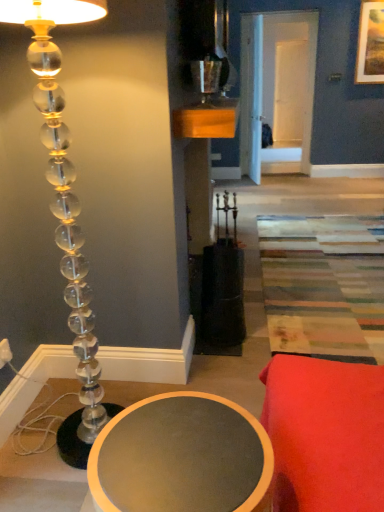
Question: Would you consider clear acrylic lamp at left to be distant from matte gray table at lower left?

Choices:
 (A) no
 (B) yes

Answer: (A)

Question: Does clear acrylic lamp at left lie behind matte gray table at lower left?

Choices:
 (A) yes
 (B) no

Answer: (A)

Question: From a real-world perspective, is clear acrylic lamp at left located higher than matte gray table at lower left?

Choices:
 (A) no
 (B) yes

Answer: (B)

Question: Is matte gray table at lower left located within clear acrylic lamp at left?

Choices:
 (A) yes
 (B) no

Answer: (B)

Question: Is clear acrylic lamp at left shorter than matte gray table at lower left?

Choices:
 (A) no
 (B) yes

Answer: (A)

Question: From the image's perspective, is clear acrylic lamp at left located beneath matte gray table at lower left?

Choices:
 (A) no
 (B) yes

Answer: (A)

Question: Is matte gray table at lower left positioned beyond the bounds of wooden framed landscape painting at upper right?

Choices:
 (A) no
 (B) yes

Answer: (B)

Question: Is matte gray table at lower left bigger than wooden framed landscape painting at upper right?

Choices:
 (A) yes
 (B) no

Answer: (A)

Question: Is matte gray table at lower left taller than wooden framed landscape painting at upper right?

Choices:
 (A) no
 (B) yes

Answer: (A)

Question: From a real-world perspective, is matte gray table at lower left on top of wooden framed landscape painting at upper right?

Choices:
 (A) no
 (B) yes

Answer: (A)

Question: Is matte gray table at lower left looking in the opposite direction of wooden framed landscape painting at upper right?

Choices:
 (A) no
 (B) yes

Answer: (A)

Question: Is matte gray table at lower left closer to the viewer compared to wooden framed landscape painting at upper right?

Choices:
 (A) yes
 (B) no

Answer: (A)

Question: Could metallic silver candle holder at upper center be considered to be inside matte gray table at lower left?

Choices:
 (A) yes
 (B) no

Answer: (B)